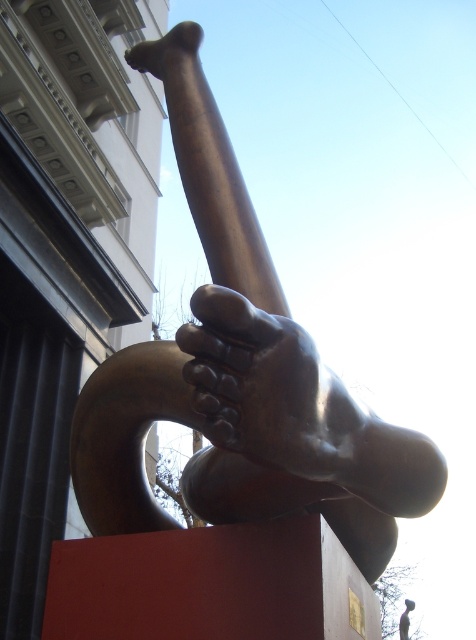
Question: Which point is closer to the camera?

Choices:
 (A) bronze/smooth hand at center
 (B) bronze sculpture at center

Answer: (A)

Question: Which object is positioned closest to the bronze/smooth hand at center?

Choices:
 (A) bronze shiny hand at upper center
 (B) bronze sculpture at center

Answer: (B)

Question: Among these points, which one is farthest from the camera?

Choices:
 (A) (290, 340)
 (B) (89, 452)
 (C) (187, 40)

Answer: (C)

Question: In this image, where is bronze sculpture at center located relative to bronze/smooth hand at center?

Choices:
 (A) above
 (B) below

Answer: (B)

Question: Can you confirm if bronze/smooth hand at center is positioned above bronze shiny hand at upper center?

Choices:
 (A) no
 (B) yes

Answer: (A)

Question: Where is bronze sculpture at center located in relation to bronze/smooth hand at center in the image?

Choices:
 (A) below
 (B) above

Answer: (A)